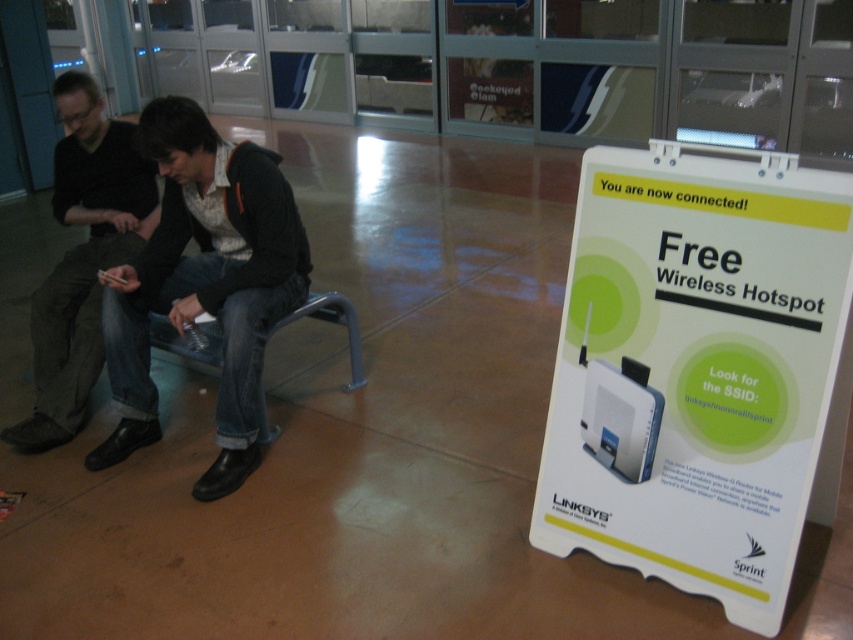
Which is behind, point (241, 312) or point (129, 182)?

Point (129, 182)

Can you confirm if jeans at left is smaller than dark brown leather shoes at lower left?

No, jeans at left is not smaller than dark brown leather shoes at lower left.

Identify the location of jeans at left. (202, 282).